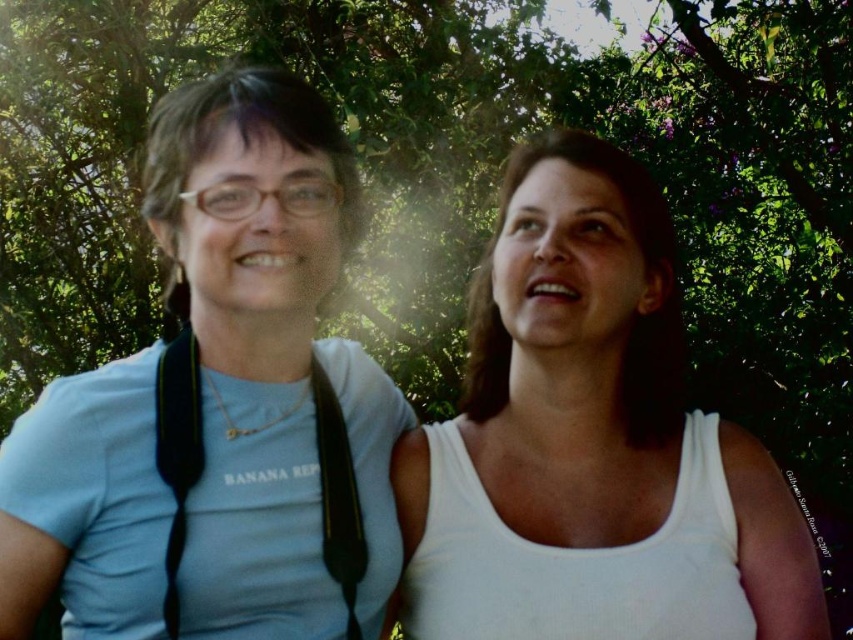
You are a photographer trying to focus on the point at coordinates point [576,352] in the image. According to the scene description, where is this point located?

The point [576,352] is on the white matte tank top at center.